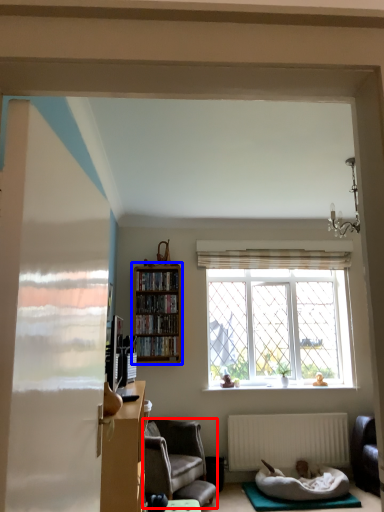
Question: Which object is closer to the camera taking this photo, chair (highlighted by a red box) or bookcase (highlighted by a blue box)?

Choices:
 (A) chair
 (B) bookcase

Answer: (A)